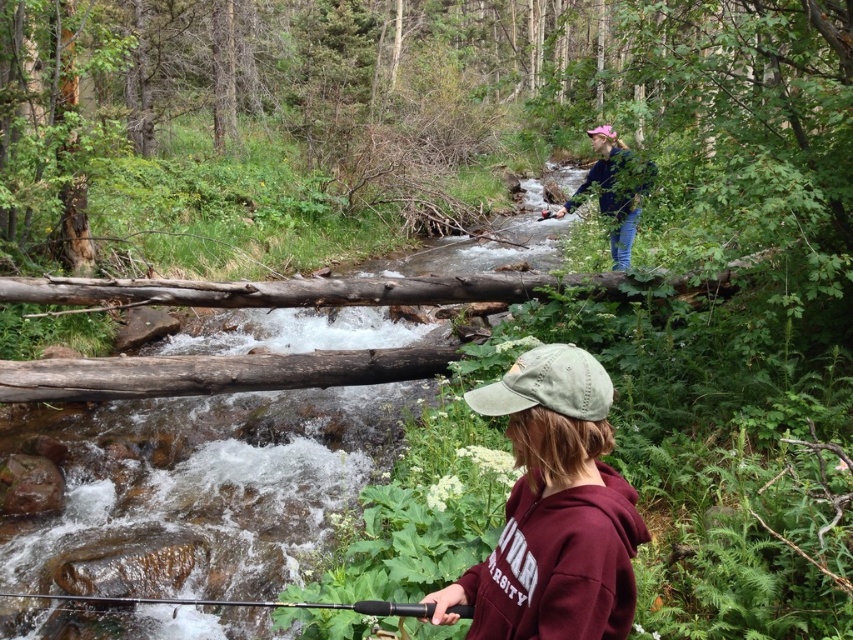
From the picture: You are a photographer trying to capture a clear shot of both the black textured fishing pole at lower center and the pink fabric baseball hat at upper center. Based on their positions, which object is closer to the camera?

The black textured fishing pole at lower center is positioned under the pink fabric baseball hat at upper center, so the pink fabric baseball hat at upper center is closer to the camera.